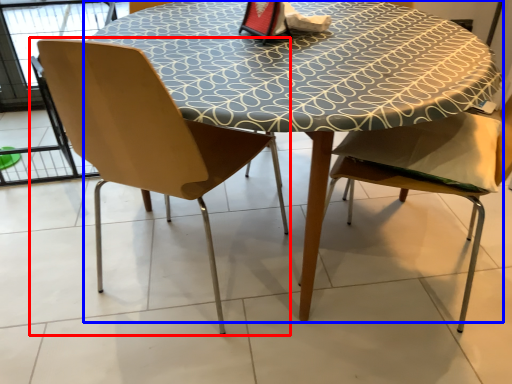
Question: Which point is further to the camera, chair (highlighted by a red box) or table (highlighted by a blue box)?

Choices:
 (A) chair
 (B) table

Answer: (B)